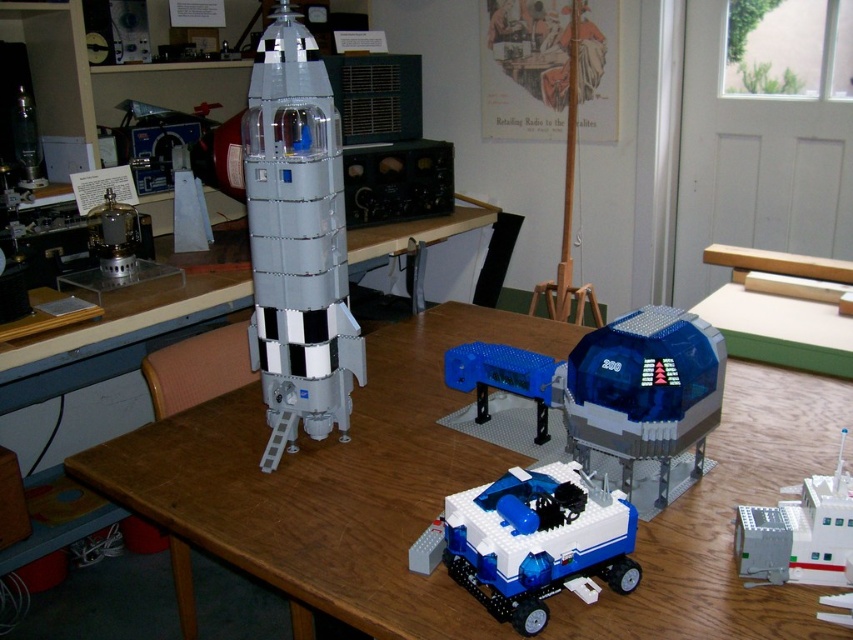
Can you confirm if blue plastic rover at center is taller than white plastic building block at lower right?

In fact, blue plastic rover at center may be shorter than white plastic building block at lower right.

Who is more distant from viewer, (596, 509) or (752, 508)?

The point (752, 508) is behind.

Find the location of a particular element. Image resolution: width=853 pixels, height=640 pixels. blue plastic rover at center is located at coordinates (532, 540).

Between wooden table at center and translucent plastic rocket at center, which one is positioned higher?

translucent plastic rocket at center is above.

Does wooden table at center have a lesser height compared to translucent plastic rocket at center?

Yes, wooden table at center is shorter than translucent plastic rocket at center.

Locate an element on the screen. The height and width of the screenshot is (640, 853). wooden table at center is located at coordinates (329, 484).

Which is behind, point (567, 401) or point (463, 344)?

Point (463, 344)

What do you see at coordinates (645, 390) in the screenshot?
I see `transparent blue spaceship at center` at bounding box center [645, 390].

This screenshot has width=853, height=640. I want to click on transparent blue spaceship at center, so click(645, 390).

At what (x,y) coordinates should I click in order to perform the action: click on transparent blue spaceship at center. Please return your answer as a coordinate pair (x, y). This screenshot has height=640, width=853. Looking at the image, I should click on (645, 390).